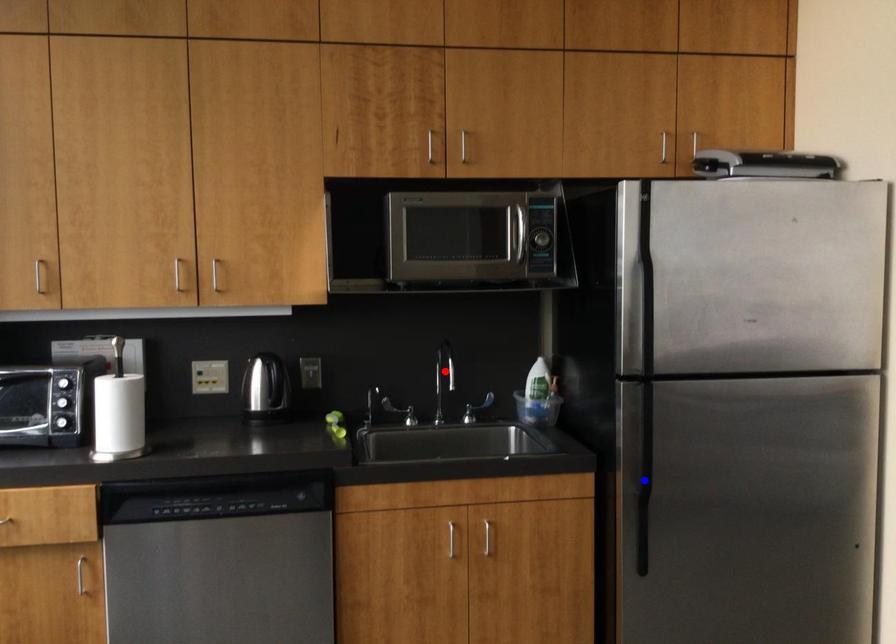
Question: Two points are marked on the image. Which point is closer to the camera?

Choices:
 (A) Blue point is closer.
 (B) Red point is closer.

Answer: (A)